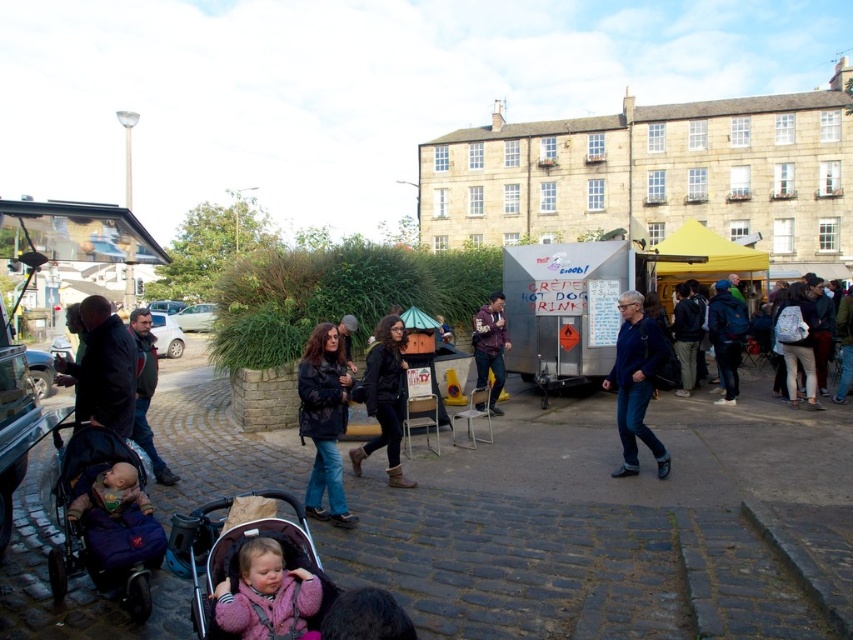
You are standing at the cobblestone street in the image and want to walk towards the large stone building in the background. Which point, point (647,371) or point (155,465), is closer to you as you face the building?

Point (647,371) is closer to you because it is further to the viewer than point (155,465), meaning it is nearer in the foreground.